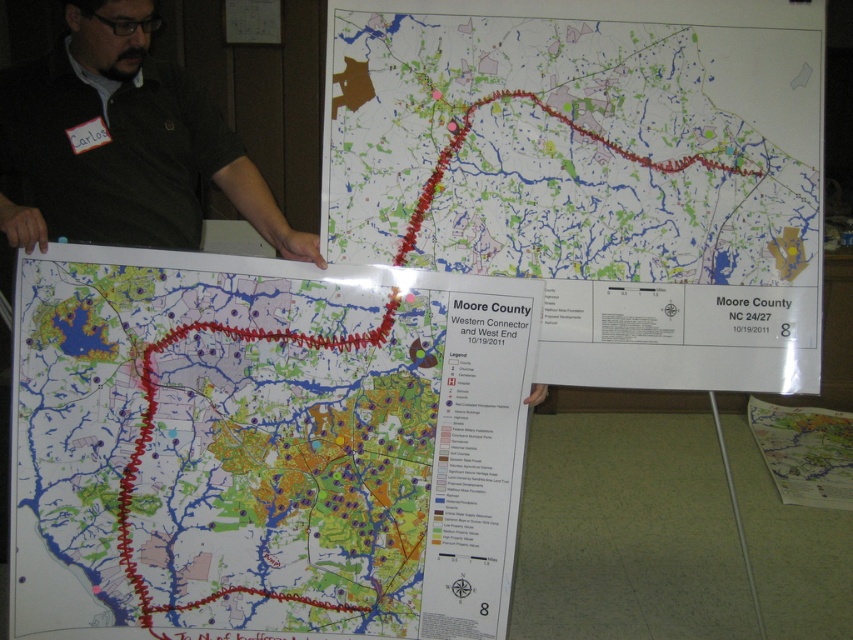
You are attending a presentation where the presenter is showing two maps. You notice two points marked on the foreground map labeled as point (146, 234) and point (755, 417). Which point is closer to you as you look at the map?

Point (146, 234) is closer to the camera than point (755, 417), so it is the closer point.

You are an attendee at the presentation and notice the matte paper map at center and the dark green shirt at upper left. Which object is wider in the image?

The matte paper map at center is wider than the dark green shirt at upper left.

You are attending a presentation where the presenter is pointing to a map. The map has a red zigzagging route and a legend on the right. There is a point marked at coordinates (263,448). Is this point located on the matte paper map at center?

Yes, the point marked at coordinates (263,448) is located on the matte paper map at center, as stated in the description.